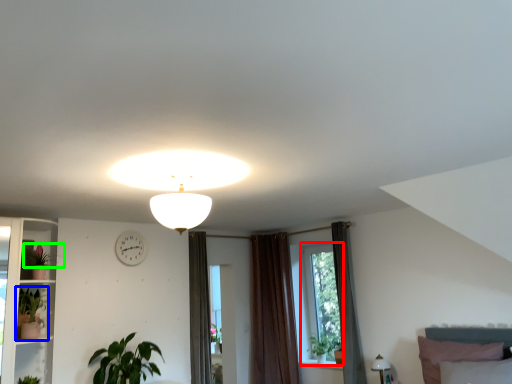
Question: Based on their relative distances, which object is farther from window (highlighted by a red box)? Choose from houseplant (highlighted by a blue box) and plant (highlighted by a green box).

Choices:
 (A) houseplant
 (B) plant

Answer: (B)